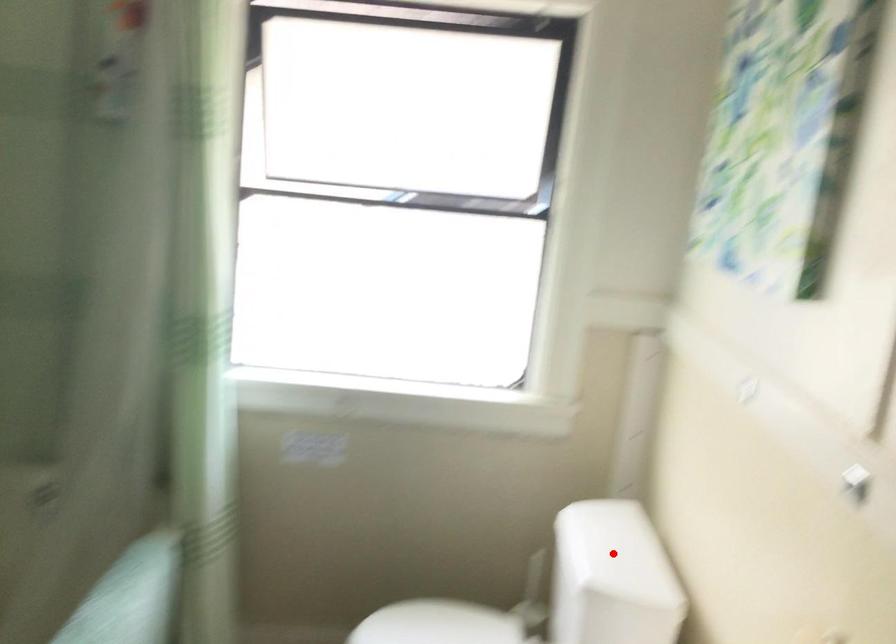
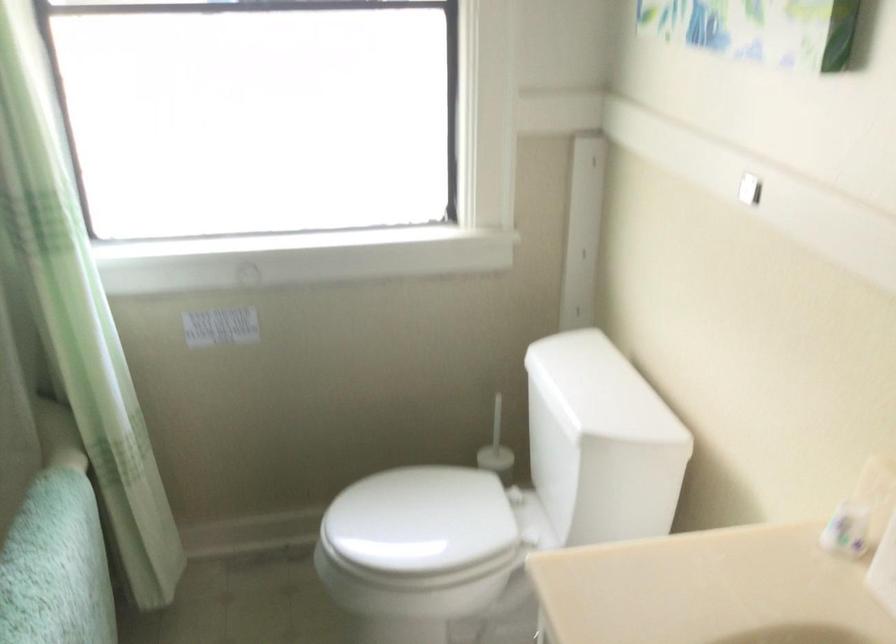
Question: I am providing you with two images of the same scene from different viewpoints. A red point is marked on the first image. Can you still see the location of the red point in image 2?

Choices:
 (A) Yes
 (B) No

Answer: (A)